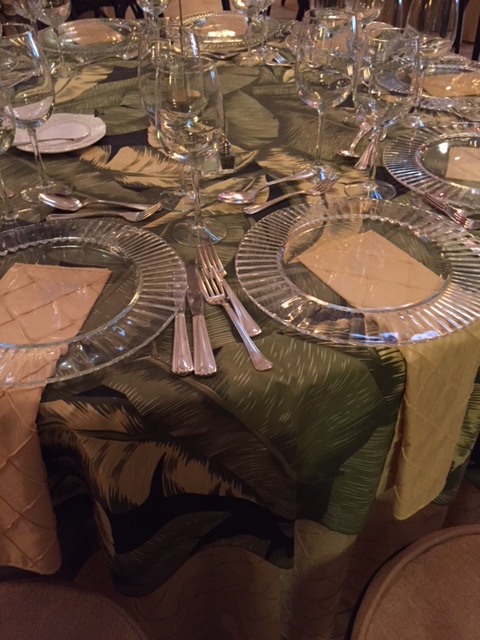
What are the coordinates of `wall` in the screenshot? It's located at (474, 22).